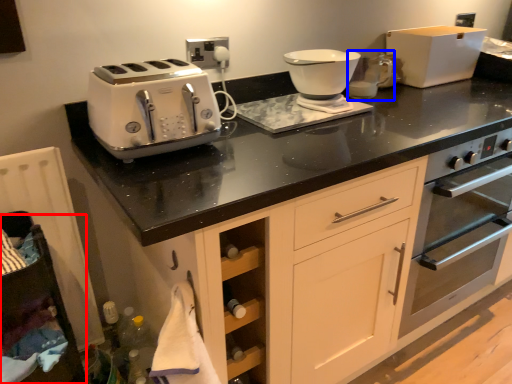
Question: Which point is closer to the camera, cabinetry (highlighted by a red box) or coffee machine (highlighted by a blue box)?

Choices:
 (A) cabinetry
 (B) coffee machine

Answer: (A)